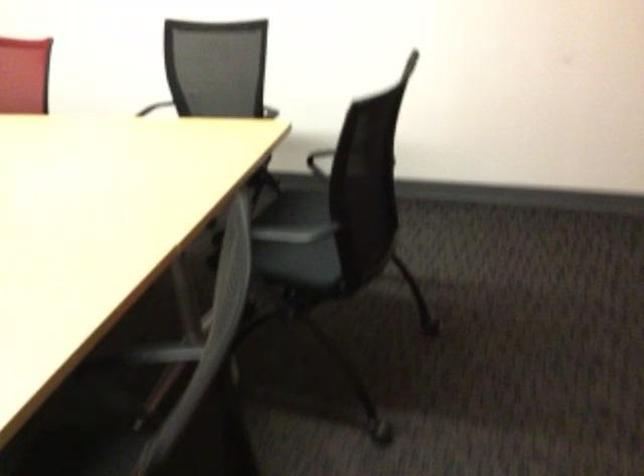
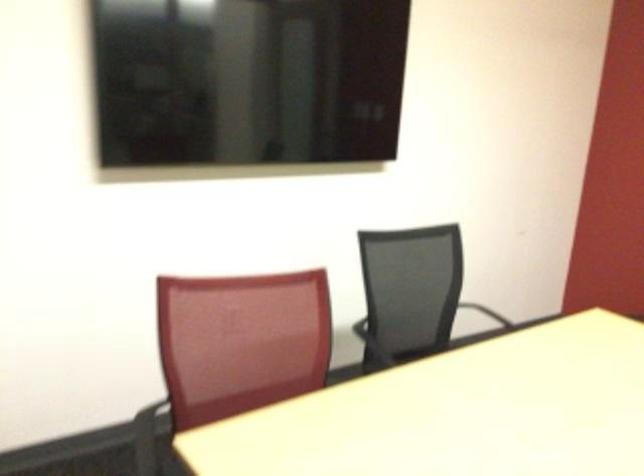
Find the pixel in the second image that matches (x=475, y=168) in the first image.

(498, 318)